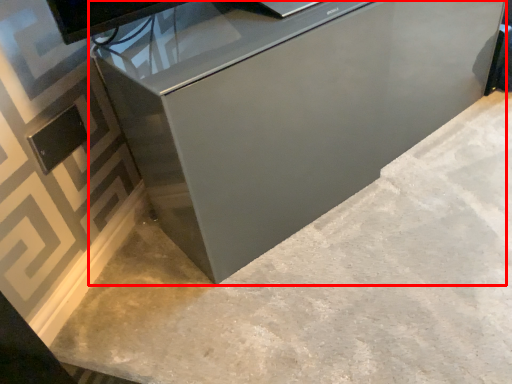
Question: In this image, where is furniture (annotated by the red box) located relative to concrete?

Choices:
 (A) left
 (B) right

Answer: (B)